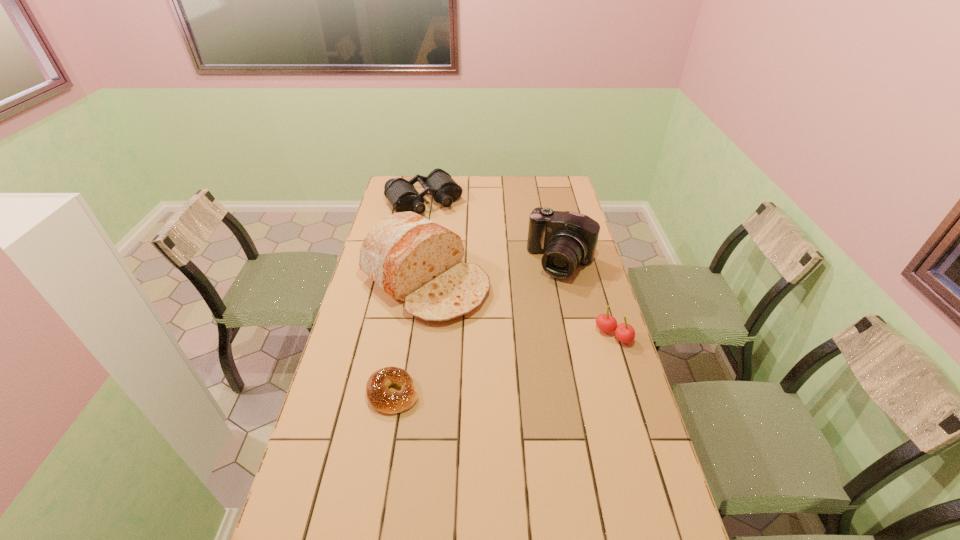
Where is `blank space that satisfies the following two spatial constraints: 1. on the front side of the farthest object; 2. on the left side of the nearest object`? blank space that satisfies the following two spatial constraints: 1. on the front side of the farthest object; 2. on the left side of the nearest object is located at coordinates (389, 393).